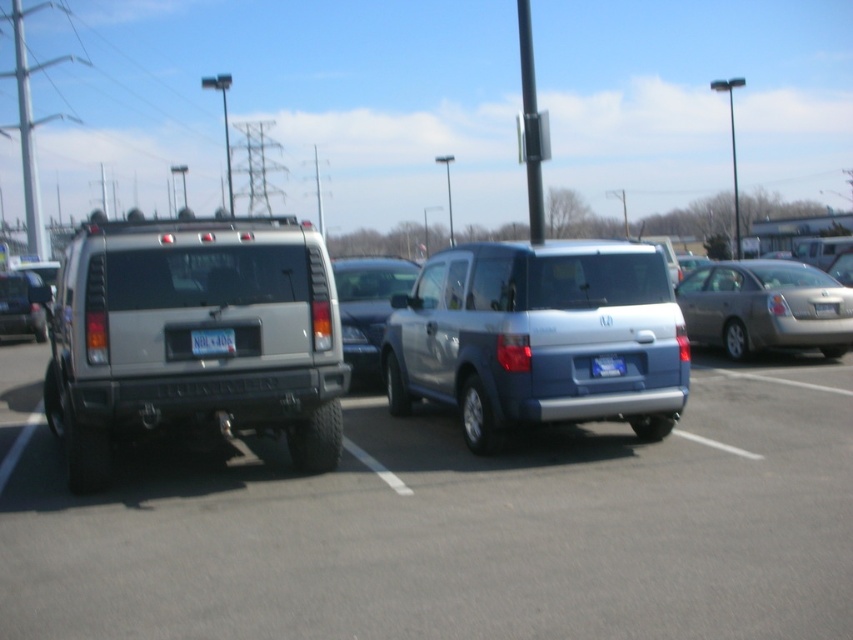
Question: Which of these objects is positioned farthest from the satin silver suv at center?

Choices:
 (A) silver metallic sedan at right
 (B) silver metallic suv at left

Answer: (A)

Question: Does silver metallic sedan at right appear over white plastic license plate at rear?

Choices:
 (A) yes
 (B) no

Answer: (A)

Question: Based on their relative distances, which object is farther from the white plastic license plate at rear?

Choices:
 (A) satin silver suv at center
 (B) blue metallic license plate at rear
 (C) silver metallic sedan at right
 (D) satin silver minivan at center

Answer: (C)

Question: Which object appears closest to the camera in this image?

Choices:
 (A) silver metallic sedan at right
 (B) silver metallic suv at left
 (C) white plastic license plate at rear
 (D) satin silver minivan at center

Answer: (B)

Question: Observing the image, what is the correct spatial positioning of satin silver suv at center in reference to silver metallic sedan at right?

Choices:
 (A) below
 (B) above

Answer: (A)

Question: Does satin silver suv at center appear under silver metallic suv at left?

Choices:
 (A) yes
 (B) no

Answer: (A)